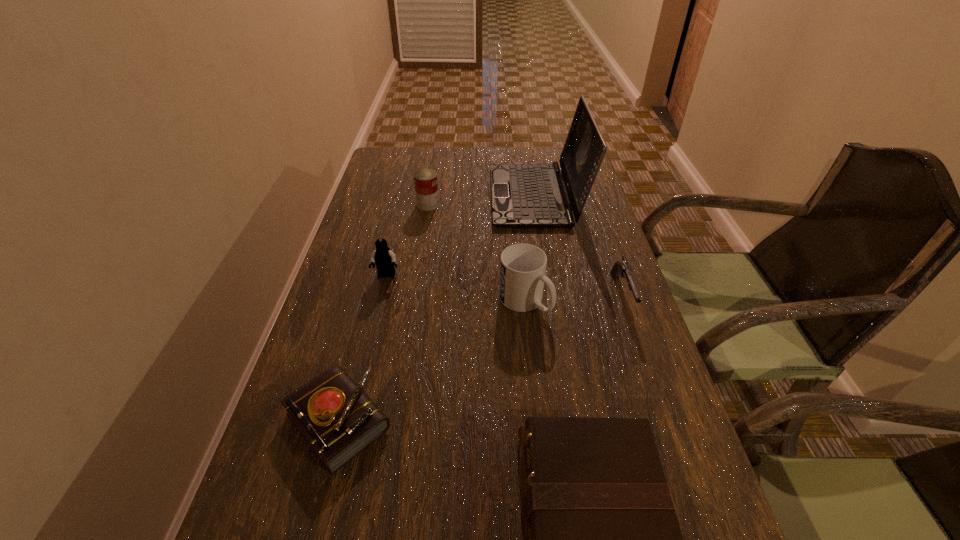
Where is `vacant space at the far edge of the desktop`? The width and height of the screenshot is (960, 540). vacant space at the far edge of the desktop is located at coordinates (472, 149).

Locate an element on the screen. vacant space at the left edge is located at coordinates (376, 276).

You are a GUI agent. You are given a task and a screenshot of the screen. Output one action in this format:
    pyautogui.click(x=<x>, y=<y>)
    Task: Click on the vacant area at the right edge of the desktop
    
    Given the screenshot: What is the action you would take?
    pyautogui.click(x=571, y=296)

This screenshot has height=540, width=960. Identify the location of vacant region at the far right corner of the desktop. (548, 148).

At what (x,y) coordinates should I click in order to perform the action: click on vacant space in between the diary and the mug. Please return your answer as a coordinate pair (x, y). Image resolution: width=960 pixels, height=540 pixels. Looking at the image, I should click on (432, 361).

Identify the location of empty space that is in between the Lego and the mug. (455, 288).

At what (x,y) coordinates should I click in order to perform the action: click on vacant area that lies between the shortest object and the can. Please return your answer as a coordinate pair (x, y). This screenshot has height=540, width=960. Looking at the image, I should click on (383, 313).

At what (x,y) coordinates should I click in order to perform the action: click on blank region between the tallest object and the rightmost object. Please return your answer as a coordinate pair (x, y). Image resolution: width=960 pixels, height=540 pixels. Looking at the image, I should click on (579, 245).

The width and height of the screenshot is (960, 540). What are the coordinates of `free space between the Lego and the can` in the screenshot? It's located at (407, 240).

Locate an element on the screen. The image size is (960, 540). free space between the can and the shortest object is located at coordinates (383, 313).